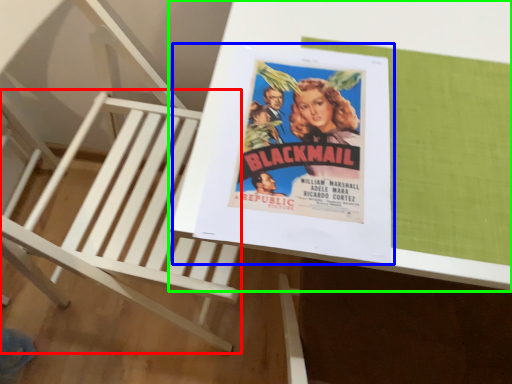
Question: Considering the real-world distances, which object is closest to furniture (highlighted by a red box)? paperback book (highlighted by a blue box) or table (highlighted by a green box).

Choices:
 (A) paperback book
 (B) table

Answer: (B)